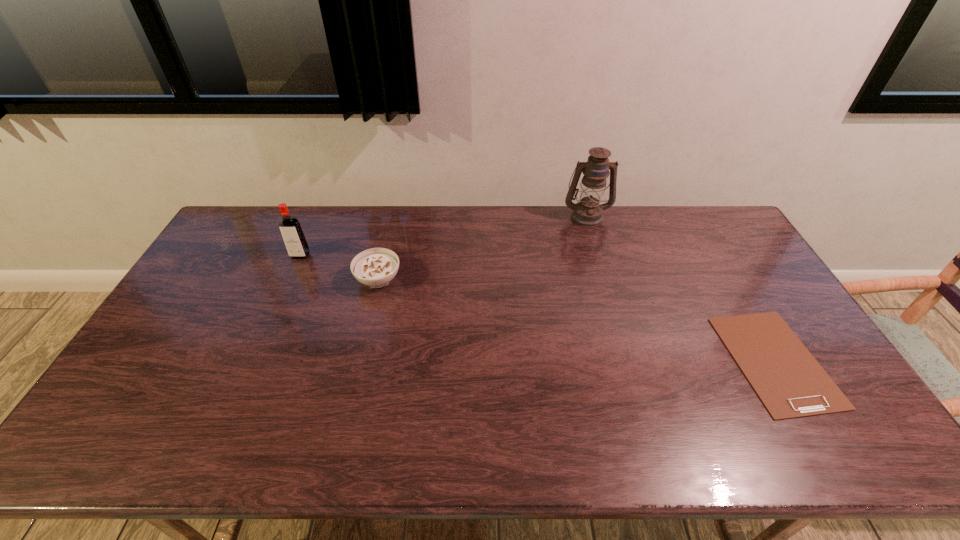
Find the location of `vacant space that satisfies the following two spatial constraints: 1. on the front and back of the second farthest object; 2. on the right side of the second object from left to right`. vacant space that satisfies the following two spatial constraints: 1. on the front and back of the second farthest object; 2. on the right side of the second object from left to right is located at coordinates (290, 279).

Locate an element on the screen. This screenshot has width=960, height=540. free space in the image that satisfies the following two spatial constraints: 1. on the back side of the second object from left to right; 2. on the right side of the oil lamp is located at coordinates (394, 216).

Find the location of a particular element. vacant area that satisfies the following two spatial constraints: 1. on the front and back of the vodka; 2. on the left side of the third tallest object is located at coordinates (290, 279).

Where is `free spot that satisfies the following two spatial constraints: 1. on the front and back of the third shortest object; 2. on the right side of the shortest object`? This screenshot has width=960, height=540. free spot that satisfies the following two spatial constraints: 1. on the front and back of the third shortest object; 2. on the right side of the shortest object is located at coordinates (253, 361).

Find the location of a particular element. Image resolution: width=960 pixels, height=540 pixels. vacant position in the image that satisfies the following two spatial constraints: 1. on the front and back of the second object from left to right; 2. on the right side of the leftmost object is located at coordinates (290, 279).